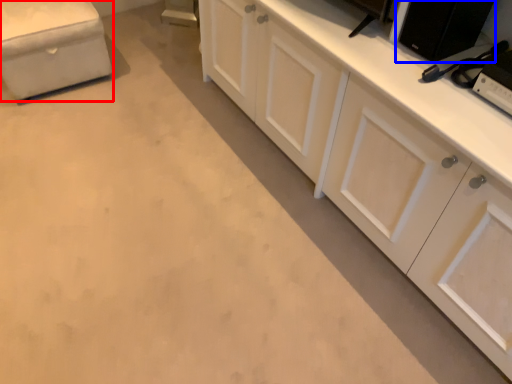
Question: Which object is further to the camera taking this photo, furniture (highlighted by a red box) or appliance (highlighted by a blue box)?

Choices:
 (A) furniture
 (B) appliance

Answer: (A)